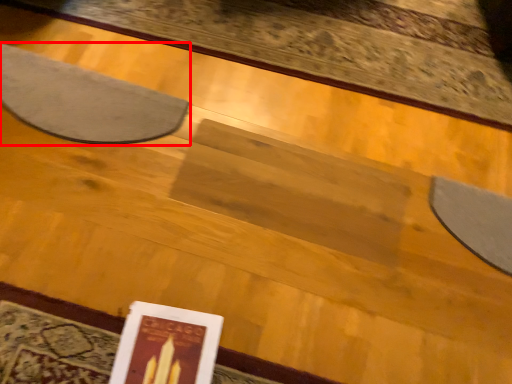
Question: In this image, where is mat (annotated by the red box) located relative to paperback book?

Choices:
 (A) right
 (B) left

Answer: (B)